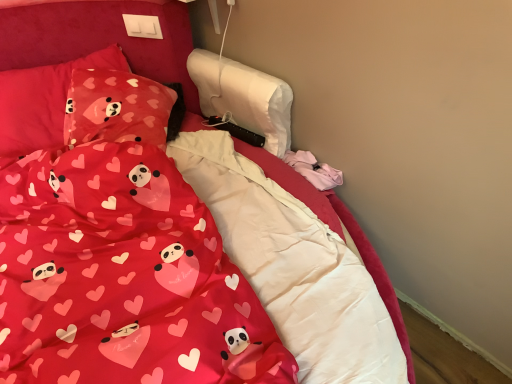
Question: Considering the relative sizes of matte pink fabric pillow at upper left, which is the second pillow in right-to-left order, and matte fabric pillow at upper left, which is the second pillow in left-to-right order, in the image provided, is matte pink fabric pillow at upper left, which is the second pillow in right-to-left order, shorter than matte fabric pillow at upper left, which is the second pillow in left-to-right order,?

Choices:
 (A) yes
 (B) no

Answer: (B)

Question: Is matte pink fabric pillow at upper left, the 1th pillow viewed from the left, smaller than matte fabric pillow at upper left, which is the second pillow in left-to-right order?

Choices:
 (A) no
 (B) yes

Answer: (A)

Question: Considering the relative sizes of matte pink fabric pillow at upper left, the 1th pillow viewed from the left, and matte fabric pillow at upper left, which is the second pillow in left-to-right order, in the image provided, is matte pink fabric pillow at upper left, the 1th pillow viewed from the left, taller than matte fabric pillow at upper left, which is the second pillow in left-to-right order,?

Choices:
 (A) no
 (B) yes

Answer: (B)

Question: Is matte pink fabric pillow at upper left, the 1th pillow viewed from the left, positioned with its back to matte fabric pillow at upper left, which is the second pillow in left-to-right order?

Choices:
 (A) no
 (B) yes

Answer: (A)

Question: Are matte pink fabric pillow at upper left, the 1th pillow viewed from the left, and matte fabric pillow at upper left, which is the second pillow in left-to-right order, far apart?

Choices:
 (A) yes
 (B) no

Answer: (B)

Question: Would you say matte red fabric at center is inside or outside matte fabric pillow at upper left, which appears as the 1th pillow when viewed from the right?

Choices:
 (A) outside
 (B) inside

Answer: (A)

Question: Is matte red fabric at center bigger or smaller than matte fabric pillow at upper left, which is the second pillow in left-to-right order?

Choices:
 (A) big
 (B) small

Answer: (A)

Question: Is point (74, 337) closer or farther from the camera than point (130, 92)?

Choices:
 (A) closer
 (B) farther

Answer: (A)

Question: From a real-world perspective, relative to matte fabric pillow at upper left, which appears as the 1th pillow when viewed from the right, is matte red fabric at center vertically above or below?

Choices:
 (A) below
 (B) above

Answer: (B)

Question: From the image's perspective, is matte fabric pillow at upper left, which appears as the 1th pillow when viewed from the right, above or below matte pink fabric pillow at upper left, the 1th pillow viewed from the left?

Choices:
 (A) above
 (B) below

Answer: (B)

Question: Is point (124, 91) closer or farther from the camera than point (7, 87)?

Choices:
 (A) farther
 (B) closer

Answer: (B)

Question: Is matte fabric pillow at upper left, which is the second pillow in left-to-right order, wider or thinner than matte pink fabric pillow at upper left, the 1th pillow viewed from the left?

Choices:
 (A) thin
 (B) wide

Answer: (A)

Question: Based on their sizes in the image, would you say matte fabric pillow at upper left, which appears as the 1th pillow when viewed from the right, is bigger or smaller than matte pink fabric pillow at upper left, which is the second pillow in right-to-left order?

Choices:
 (A) small
 (B) big

Answer: (A)

Question: Is matte fabric pillow at upper left, which is the second pillow in left-to-right order, situated inside matte red fabric at center or outside?

Choices:
 (A) outside
 (B) inside

Answer: (A)

Question: In terms of height, does matte fabric pillow at upper left, which appears as the 1th pillow when viewed from the right, look taller or shorter compared to matte red fabric at center?

Choices:
 (A) tall
 (B) short

Answer: (B)